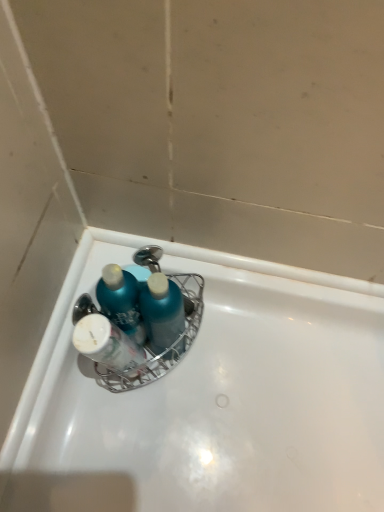
Where is `free space in front of white glossy bottle at center`? free space in front of white glossy bottle at center is located at coordinates (118, 446).